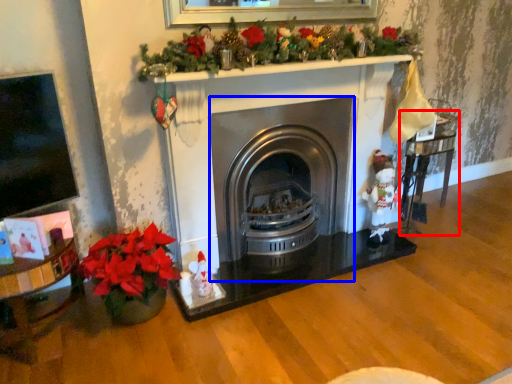
Question: Which of the following is the farthest to the observer, table (highlighted by a red box) or wood burning stove (highlighted by a blue box)?

Choices:
 (A) table
 (B) wood burning stove

Answer: (A)